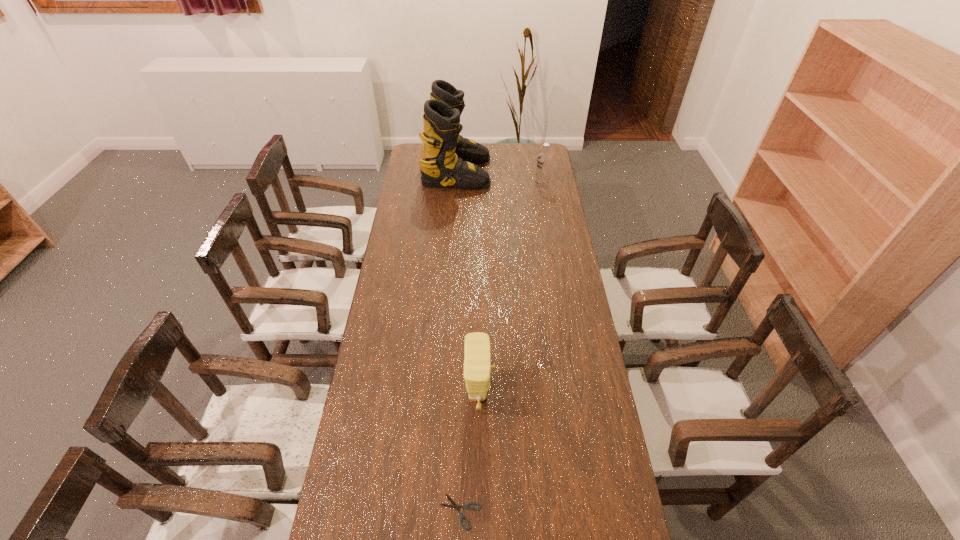
This screenshot has width=960, height=540. Find the location of `the tallest object`. the tallest object is located at coordinates (447, 159).

Find the location of a particular element. The height and width of the screenshot is (540, 960). the rightmost object is located at coordinates (544, 161).

This screenshot has width=960, height=540. I want to click on sponge, so click(x=477, y=358).

The image size is (960, 540). I want to click on the nearest object, so click(x=454, y=505).

Locate an element on the screen. The height and width of the screenshot is (540, 960). the shortest object is located at coordinates (454, 505).

This screenshot has width=960, height=540. Identify the location of vacant space positioned 0.320m on the front of the tallest object. (452, 237).

The image size is (960, 540). Find the location of `free location located on the front label of the vodka`. free location located on the front label of the vodka is located at coordinates (469, 185).

Locate an element on the screen. This screenshot has width=960, height=540. blank space located on the front label of the vodka is located at coordinates (493, 185).

This screenshot has width=960, height=540. Identify the location of free location located 0.260m on the front label of the vodka. (483, 185).

This screenshot has height=540, width=960. I want to click on free region located on the face of the second nearest object, so click(563, 394).